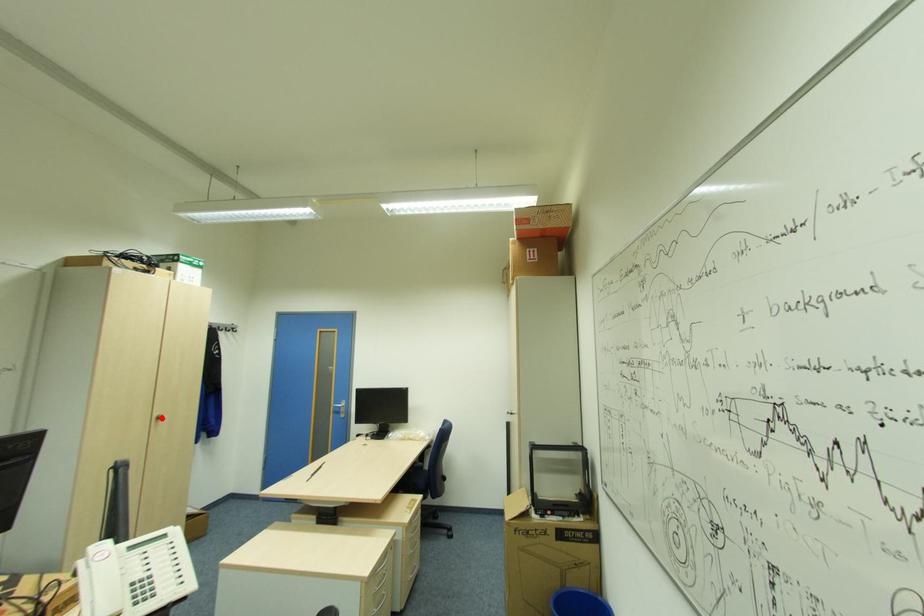
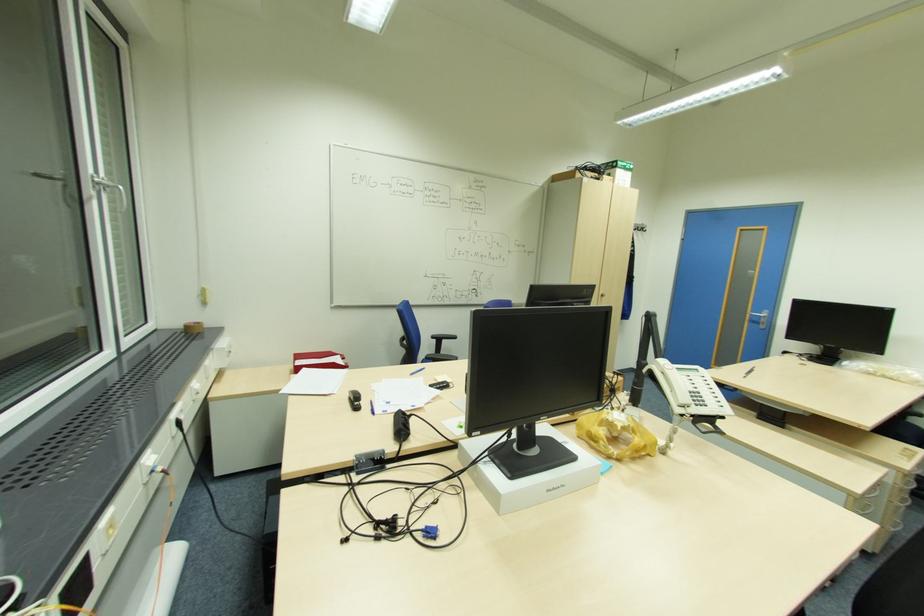
Question: I am providing you with two images of the same scene from different viewpoints. Image1 has a red point marked. In image2, the corresponding 3D location appears at what relative position? Reply with the corresponding letter.

Choices:
 (A) Closer
 (B) Farther

Answer: (B)